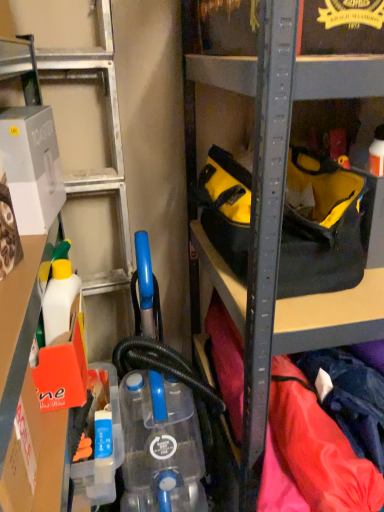
Question: In terms of size, does blue translucent bottle at lower center appear bigger or smaller than white plastic container at left?

Choices:
 (A) small
 (B) big

Answer: (A)

Question: From the image's perspective, is blue translucent bottle at lower center located above or below white plastic container at left?

Choices:
 (A) below
 (B) above

Answer: (A)

Question: Which of these objects is positioned closest to the blue translucent bottle at lower center?

Choices:
 (A) white plastic container at left
 (B) yellow fabric tool bag at center
 (C) white cardboard toaster at left

Answer: (C)

Question: Which object is the farthest from the white plastic container at left?

Choices:
 (A) white cardboard toaster at left
 (B) blue translucent bottle at lower center
 (C) yellow fabric tool bag at center

Answer: (B)